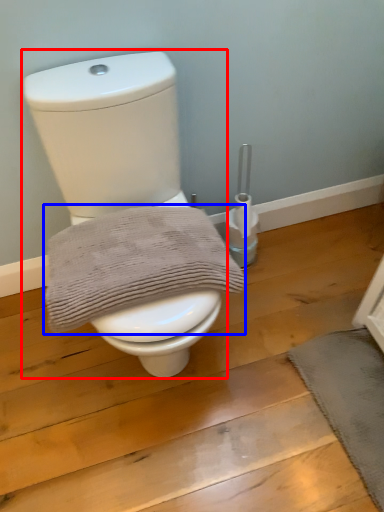
Question: Which object appears closest to the camera in this image, toilet (highlighted by a red box) or bath towel (highlighted by a blue box)?

Choices:
 (A) toilet
 (B) bath towel

Answer: (A)